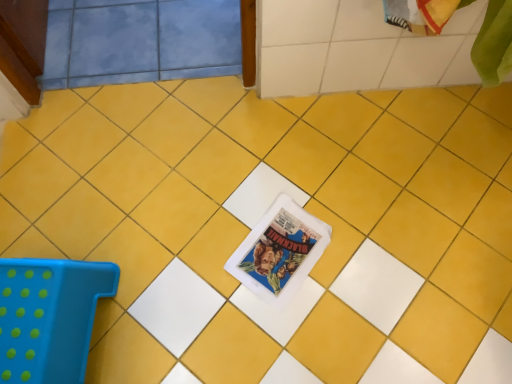
Question: Considering the positions of point (263, 264) and point (49, 259), is point (263, 264) closer or farther from the camera than point (49, 259)?

Choices:
 (A) closer
 (B) farther

Answer: (B)

Question: Considering the positions of matte plastic comic book at center and blue plastic stool at lower left in the image, is matte plastic comic book at center taller or shorter than blue plastic stool at lower left?

Choices:
 (A) tall
 (B) short

Answer: (B)

Question: From the image's perspective, is matte plastic comic book at center above or below blue plastic stool at lower left?

Choices:
 (A) below
 (B) above

Answer: (B)

Question: From their relative heights in the image, would you say blue plastic stool at lower left is taller or shorter than matte plastic comic book at center?

Choices:
 (A) short
 (B) tall

Answer: (B)

Question: Considering the positions of point (116, 278) and point (266, 254), is point (116, 278) closer or farther from the camera than point (266, 254)?

Choices:
 (A) closer
 (B) farther

Answer: (A)

Question: From the image's perspective, is blue plastic stool at lower left positioned above or below matte plastic comic book at center?

Choices:
 (A) above
 (B) below

Answer: (B)

Question: Is blue plastic stool at lower left wider or thinner than matte plastic comic book at center?

Choices:
 (A) thin
 (B) wide

Answer: (B)